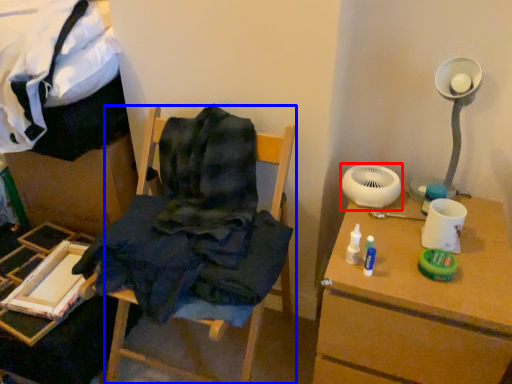
Question: Which object appears closest to the camera in this image, mechanical fan (highlighted by a red box) or furniture (highlighted by a blue box)?

Choices:
 (A) mechanical fan
 (B) furniture

Answer: (B)